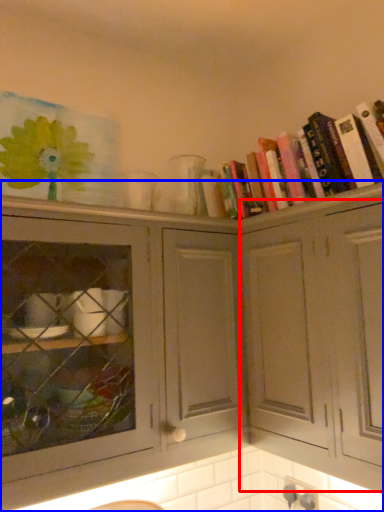
Question: Which of the following is the farthest to the observer, cabinetry (highlighted by a red box) or cabinetry (highlighted by a blue box)?

Choices:
 (A) cabinetry
 (B) cabinetry

Answer: (B)